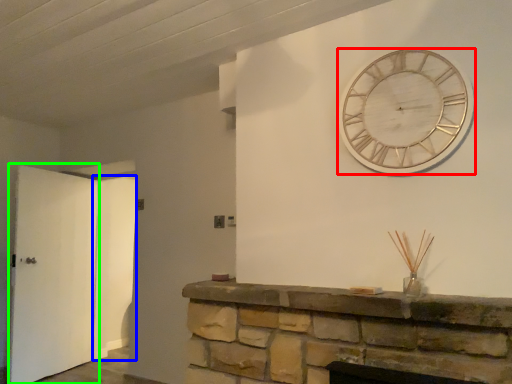
Question: Which is nearer to the wall clock (highlighted by a red box)? door (highlighted by a blue box) or door (highlighted by a green box).

Choices:
 (A) door
 (B) door

Answer: (B)